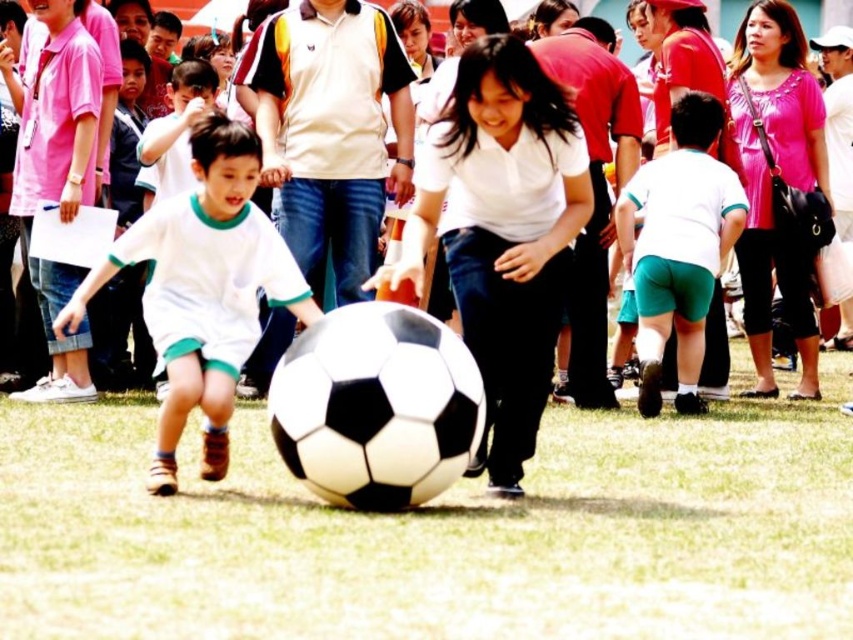
Question: Is white matte soccer ball at lower left above green fabric shorts at lower right?

Choices:
 (A) yes
 (B) no

Answer: (B)

Question: Among these objects, which one is farthest from the camera?

Choices:
 (A) matte white soccer ball at center
 (B) white matte soccer ball at lower left
 (C) green fabric shorts at lower right

Answer: (A)

Question: Which is nearer to the green fabric shorts at lower right?

Choices:
 (A) matte white soccer ball at center
 (B) white matte soccer ball at lower left

Answer: (A)

Question: Which object is positioned closest to the white matte soccer ball at lower left?

Choices:
 (A) green fabric shorts at lower right
 (B) matte white soccer ball at center

Answer: (A)

Question: Is white matte soccer ball at lower left behind green fabric shorts at lower right?

Choices:
 (A) no
 (B) yes

Answer: (A)

Question: Is green fabric shorts at lower right smaller than matte white soccer ball at center?

Choices:
 (A) no
 (B) yes

Answer: (B)